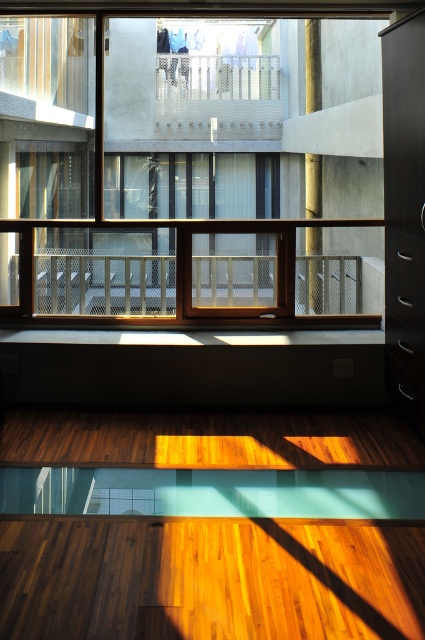
You are an interior designer planning to install a new decorative item. You have two options to choose from. The first is a large decorative item that needs to be placed on the metallic mesh balcony at center. The second is a smaller decorative item that needs to be placed on the gold textured pillar at center. Based on the sizes of the objects in the scene, which decorative item would be more appropriate for each location?

The metallic mesh balcony at center is bigger than the gold textured pillar at center, so the large decorative item would be more appropriate for the metallic mesh balcony at center, while the smaller decorative item would fit better on the gold textured pillar at center.

You are a delivery robot with a height of 1.5 meters. You need to move from the entrance to the glass partition in the foreground. The path between clear glass window at center and gold textured pillar at center is 6.43 meters. Can you pass through this path without any obstacles?

The distance between the clear glass window at center and gold textured pillar at center is 6.43 meters, so yes, the delivery robot can pass through the path between them since the distance is sufficient for movement.